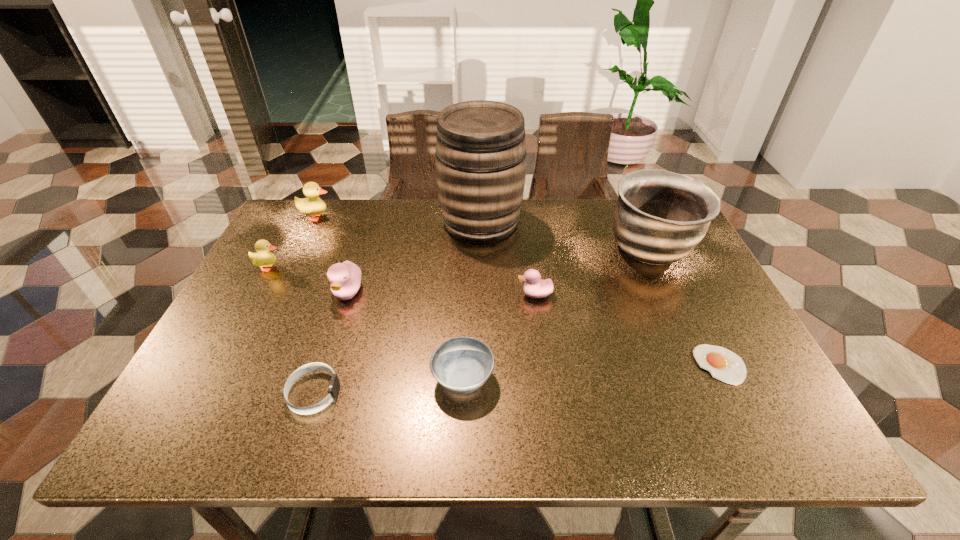
The image size is (960, 540). Find the location of `object identified as the third closest to the pottery`. object identified as the third closest to the pottery is located at coordinates (480, 152).

Where is `object that can be found as the fourth closest to the left pink duckling`? Image resolution: width=960 pixels, height=540 pixels. object that can be found as the fourth closest to the left pink duckling is located at coordinates click(462, 365).

Locate which duckling ranks in proximity to the eighth tallest object. Please provide its 2D coordinates. Your answer should be formatted as a tuple, i.e. [(x, y)], where the tuple contains the x and y coordinates of a point satisfying the conditions above.

[(345, 278)]

In order to click on duckling that stands as the fourth closest to the ashtray in this screenshot , I will do (313, 205).

Identify the location of free spot that satisfies the following two spatial constraints: 1. on the front-facing side of the pottery; 2. on the left side of the farther yellow duckling. (300, 250).

Locate an element on the screen. free location that satisfies the following two spatial constraints: 1. on the front-facing side of the bigger yellow duckling; 2. on the back side of the pottery is located at coordinates (300, 250).

I want to click on free point that satisfies the following two spatial constraints: 1. on the back side of the third shortest object; 2. on the front-facing side of the farther yellow duckling, so click(x=468, y=217).

Image resolution: width=960 pixels, height=540 pixels. What are the coordinates of `free space that satisfies the following two spatial constraints: 1. on the front-facing side of the third nearest duckling; 2. on the back side of the ashtray` in the screenshot? It's located at (208, 379).

Locate an element on the screen. This screenshot has height=540, width=960. blank space that satisfies the following two spatial constraints: 1. on the front side of the second tallest object; 2. on the left side of the tallest object is located at coordinates (481, 250).

Image resolution: width=960 pixels, height=540 pixels. Find the location of `free space that satisfies the following two spatial constraints: 1. on the back side of the egg yolk; 2. on the front-facing side of the right pink duckling`. free space that satisfies the following two spatial constraints: 1. on the back side of the egg yolk; 2. on the front-facing side of the right pink duckling is located at coordinates (685, 294).